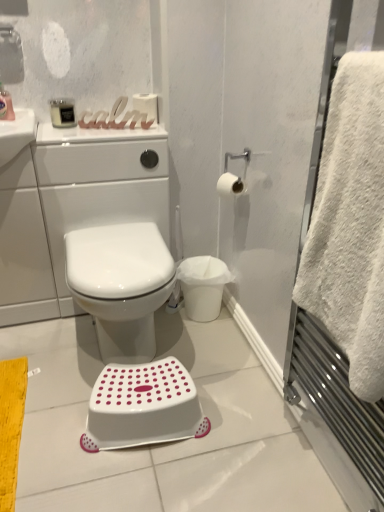
You are a GUI agent. You are given a task and a screenshot of the screen. Output one action in this format:
    pyautogui.click(x=<x>, y=<y>)
    Task: Click on the matte black device at upper left, arranged as the 2th toiletry when viewed from the left
    This screenshot has height=512, width=384.
    Given the screenshot: What is the action you would take?
    pyautogui.click(x=62, y=112)

In order to face white matte toilet paper at upper center, marked as the 1th toilet paper in a left-to-right arrangement, should I rotate leftwards or rightwards?

It's best to rotate left around 6.059 degrees.

Measure the distance between white matte toilet paper at upper center, which appears as the first toilet paper when viewed from the top, and camera.

white matte toilet paper at upper center, which appears as the first toilet paper when viewed from the top, and camera are 5.36 feet apart.

What do you see at coordinates (230, 185) in the screenshot? I see `white matte toilet paper at upper right, the 2th toilet paper positioned from the left` at bounding box center [230, 185].

Locate an element on the screen. Image resolution: width=384 pixels, height=512 pixels. white matte toilet paper at upper right, marked as the first toilet paper in a bottom-to-top arrangement is located at coordinates (230, 185).

Image resolution: width=384 pixels, height=512 pixels. What are the coordinates of `white fluffy towel at right` in the screenshot? It's located at (350, 224).

Considering the relative sizes of white glossy bidet at center and white glossy toilet at center in the image provided, is white glossy bidet at center bigger than white glossy toilet at center?

Incorrect, white glossy bidet at center is not larger than white glossy toilet at center.

How distant is white glossy bidet at center from white glossy toilet at center?

They are 12.02 inches apart.

Is white glossy bidet at center outside of white glossy toilet at center?

That's correct, white glossy bidet at center is outside of white glossy toilet at center.

Consider the image. In terms of height, does white glossy bidet at center look taller or shorter compared to white glossy toilet at center?

white glossy bidet at center is shorter than white glossy toilet at center.

Who is bigger, white fluffy towel at right or matte black soap dispenser at upper left, which is the first toiletry from left to right?

With larger size is white fluffy towel at right.

Which object is positioned more to the left, white fluffy towel at right or matte black soap dispenser at upper left, which is the first toiletry from left to right?

matte black soap dispenser at upper left, which is the first toiletry from left to right.

From a real-world perspective, is white fluffy towel at right on top of matte black soap dispenser at upper left, the second toiletry when ordered from right to left?

No, from a real-world perspective, white fluffy towel at right is not on top of matte black soap dispenser at upper left, the second toiletry when ordered from right to left.

From the image's perspective, which is above, matte black soap dispenser at upper left, which is the first toiletry from left to right, or white matte toilet paper at upper center, which appears as the first toilet paper when viewed from the back?

From the image's view, white matte toilet paper at upper center, which appears as the first toilet paper when viewed from the back, is above.

Are matte black soap dispenser at upper left, the second toiletry when ordered from right to left, and white matte toilet paper at upper center, which appears as the first toilet paper when viewed from the back, making contact?

No, matte black soap dispenser at upper left, the second toiletry when ordered from right to left, is not making contact with white matte toilet paper at upper center, which appears as the first toilet paper when viewed from the back.

Which object is positioned more to the right, matte black soap dispenser at upper left, the second toiletry when ordered from right to left, or white matte toilet paper at upper center, which appears as the first toilet paper when viewed from the back?

white matte toilet paper at upper center, which appears as the first toilet paper when viewed from the back.

Find the location of a particular element. The image size is (384, 512). the 1st toilet paper to the right when counting from the matte black soap dispenser at upper left, the second toiletry when ordered from right to left is located at coordinates (146, 106).

Which object is wider, white glossy bidet at center or white matte toilet paper at upper center, positioned as the 2th toilet paper in bottom-to-top order?

white glossy bidet at center is wider.

Considering the relative sizes of white glossy bidet at center and white matte toilet paper at upper center, positioned as the 2th toilet paper in bottom-to-top order, in the image provided, is white glossy bidet at center shorter than white matte toilet paper at upper center, positioned as the 2th toilet paper in bottom-to-top order,?

In fact, white glossy bidet at center may be taller than white matte toilet paper at upper center, positioned as the 2th toilet paper in bottom-to-top order.

From a real-world perspective, which is physically below, white glossy bidet at center or white matte toilet paper at upper center, marked as the 1th toilet paper in a left-to-right arrangement?

white glossy bidet at center is physically lower.

From the image's perspective, would you say white matte toilet paper at upper right, the first toilet paper from the front, is shown under white plastic step stool at center?

No, from the image's perspective, white matte toilet paper at upper right, the first toilet paper from the front, is not beneath white plastic step stool at center.

From a real-world perspective, does white matte toilet paper at upper right, the first toilet paper when ordered from right to left, sit lower than white plastic step stool at center?

No.

Can you confirm if white matte toilet paper at upper right, which appears as the second toilet paper when viewed from the back, is smaller than white plastic step stool at center?

Yes, white matte toilet paper at upper right, which appears as the second toilet paper when viewed from the back, is smaller than white plastic step stool at center.

Is point (237, 179) positioned before point (134, 425)?

No, (237, 179) is further to viewer.

Would you consider matte black soap dispenser at upper left, the second toiletry when ordered from right to left, to be distant from white glossy toilet at center?

No, matte black soap dispenser at upper left, the second toiletry when ordered from right to left, is in close proximity to white glossy toilet at center.

From a real-world perspective, which is physically above, matte black soap dispenser at upper left, the second toiletry when ordered from right to left, or white glossy toilet at center?

matte black soap dispenser at upper left, the second toiletry when ordered from right to left, from a real-world perspective.

From a real-world perspective, which toiletry is the 2nd one above the white glossy toilet at center? Please provide its 2D coordinates.

[(6, 105)]

Locate an element on the screen. This screenshot has height=512, width=384. toiletry located behind the matte black soap dispenser at upper left, the second toiletry when ordered from right to left is located at coordinates (62, 112).

Which object is wider, matte black device at upper left, which is the first toiletry in right-to-left order, or matte black soap dispenser at upper left, which is the first toiletry from left to right?

matte black soap dispenser at upper left, which is the first toiletry from left to right, is wider.

Does point (53, 108) come behind point (12, 112)?

Yes, it is.

Considering the positions of objects matte black device at upper left, which is the first toiletry in right-to-left order, and matte black soap dispenser at upper left, which is the first toiletry from left to right, in the image provided, who is more to the left, matte black device at upper left, which is the first toiletry in right-to-left order, or matte black soap dispenser at upper left, which is the first toiletry from left to right,?

From the viewer's perspective, matte black soap dispenser at upper left, which is the first toiletry from left to right, appears more on the left side.

Identify the location of bidet that appears below the white glossy toilet at center (from the image's perspective). The image size is (384, 512). (120, 285).

At what (x,y) coordinates should I click in order to perform the action: click on the 2nd toiletry to the left when counting from the white fluffy towel at right. Please return your answer as a coordinate pair (x, y). This screenshot has width=384, height=512. Looking at the image, I should click on (6, 105).

Based on their spatial positions, is white matte toilet paper at upper right, the first toilet paper from the front, or white plastic step stool at center further from white fluffy towel at right?

Based on the image, white matte toilet paper at upper right, the first toilet paper from the front, appears to be further to white fluffy towel at right.

Considering their positions, is white glossy toilet at center positioned further to matte black device at upper left, arranged as the 2th toiletry when viewed from the left, than white glossy bidet at center?

white glossy bidet at center is further to matte black device at upper left, arranged as the 2th toiletry when viewed from the left.

Which object lies further to the anchor point matte black device at upper left, which is the first toiletry in right-to-left order, white matte toilet paper at upper right, which appears as the second toilet paper when viewed from the back, or white fluffy towel at right?

The object further to matte black device at upper left, which is the first toiletry in right-to-left order, is white fluffy towel at right.

From the image, which object appears to be nearer to white matte toilet paper at upper center, which appears as the first toilet paper when viewed from the top, white matte toilet paper at upper right, arranged as the 2th toilet paper when viewed from the top, or white glossy toilet at center?

white glossy toilet at center is closer to white matte toilet paper at upper center, which appears as the first toilet paper when viewed from the top.

From the picture: Looking at the image, which one is located further to white fluffy towel at right, white glossy bidet at center or white matte toilet paper at upper right, the first toilet paper from the front?

white matte toilet paper at upper right, the first toilet paper from the front, is positioned further to the anchor white fluffy towel at right.

Looking at the image, which one is located further to white glossy toilet at center, white fluffy towel at right or matte black soap dispenser at upper left, the second toiletry when ordered from right to left?

Based on the image, white fluffy towel at right appears to be further to white glossy toilet at center.

When comparing their distances from white glossy bidet at center, does white fluffy towel at right or matte black device at upper left, which is the first toiletry in right-to-left order, seem further?

white fluffy towel at right is further to white glossy bidet at center.

From the image, which object appears to be nearer to white fluffy towel at right, white plastic step stool at center or white matte toilet paper at upper center, which appears as the first toilet paper when viewed from the top?

The object closer to white fluffy towel at right is white plastic step stool at center.

The width and height of the screenshot is (384, 512). I want to click on toilet paper between white matte toilet paper at upper center, marked as the 1th toilet paper in a left-to-right arrangement, and white plastic step stool at center vertically, so [230, 185].

Where is `porcelain located between white fluffy towel at right and white matte toilet paper at upper right, arranged as the 2th toilet paper when viewed from the top, in the depth direction`? porcelain located between white fluffy towel at right and white matte toilet paper at upper right, arranged as the 2th toilet paper when viewed from the top, in the depth direction is located at coordinates (106, 224).

The height and width of the screenshot is (512, 384). Find the location of `porcelain between white matte toilet paper at upper center, which appears as the first toilet paper when viewed from the top, and white glossy bidet at center from top to bottom`. porcelain between white matte toilet paper at upper center, which appears as the first toilet paper when viewed from the top, and white glossy bidet at center from top to bottom is located at coordinates pos(106,224).

I want to click on bidet between matte black device at upper left, which is the first toiletry in right-to-left order, and white plastic step stool at center, in the vertical direction, so click(x=120, y=285).